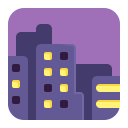
Find the location of a particular element. lit window is located at coordinates (47, 54).